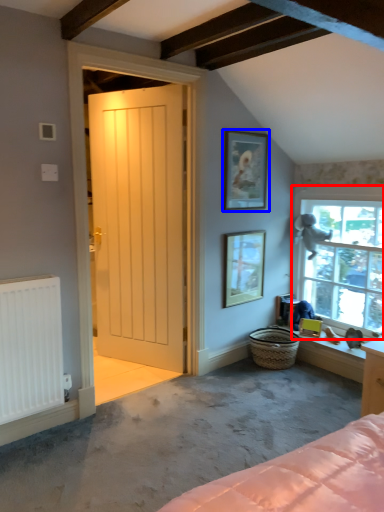
Question: Which object appears closest to the camera in this image, window (highlighted by a red box) or picture frame (highlighted by a blue box)?

Choices:
 (A) window
 (B) picture frame

Answer: (A)